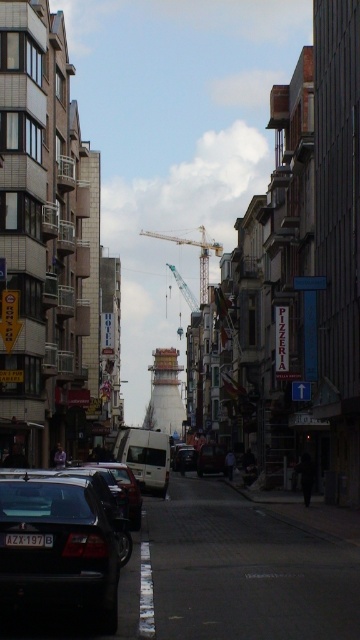
Question: Does yellow metallic crane at center appear under shiny silver van at center?

Choices:
 (A) no
 (B) yes

Answer: (A)

Question: Does shiny black sedan at lower left have a lesser width compared to shiny silver van at center?

Choices:
 (A) no
 (B) yes

Answer: (B)

Question: Which object appears closest to the camera in this image?

Choices:
 (A) yellow metallic crane at center
 (B) black plastic license plate at center
 (C) metallic silver van at center
 (D) shiny silver van at center

Answer: (B)

Question: Can you confirm if yellow metallic crane at center is smaller than metallic silver van at center?

Choices:
 (A) no
 (B) yes

Answer: (A)

Question: Which object is positioned farthest from the black plastic license plate at center?

Choices:
 (A) yellow metallic crane at center
 (B) metallic silver van at center
 (C) shiny silver van at center

Answer: (A)

Question: Which object is positioned farthest from the shiny silver van at center?

Choices:
 (A) shiny black sedan at lower left
 (B) yellow metallic crane at center

Answer: (B)